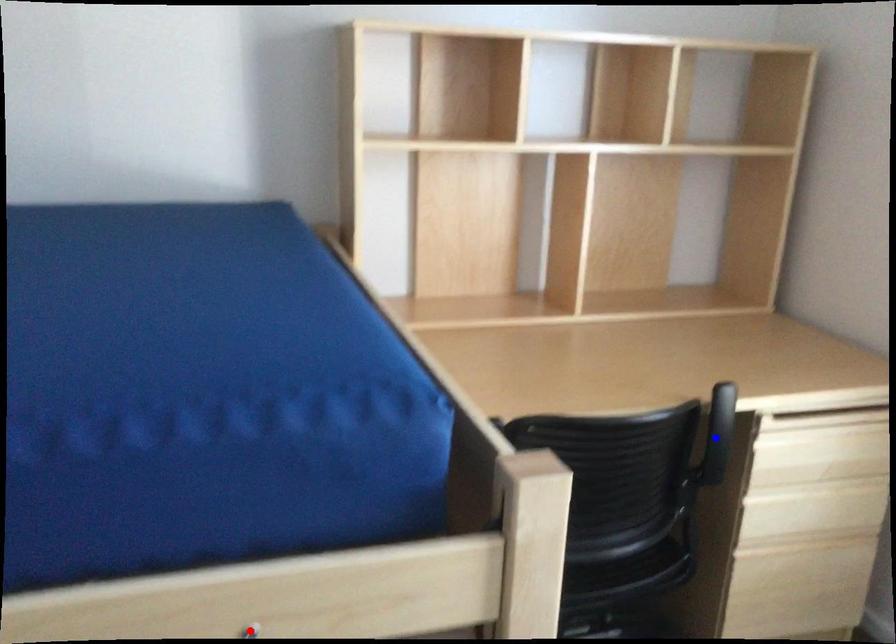
Question: Two points are marked on the image. Which point is closer to the camera?

Choices:
 (A) Blue point is closer.
 (B) Red point is closer.

Answer: (B)